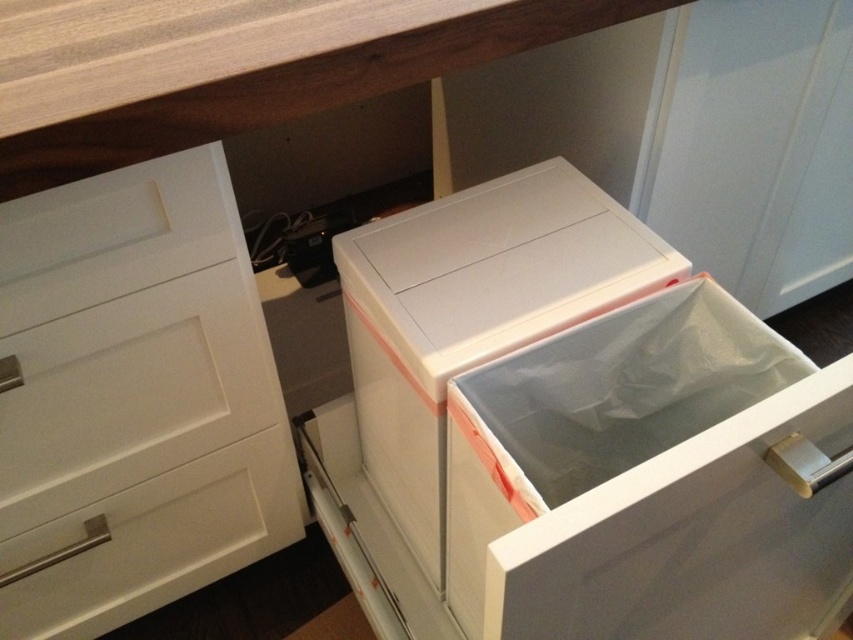
Is white matte drawer at left above wooden countertop at upper center?

Incorrect, white matte drawer at left is not positioned above wooden countertop at upper center.

Is white matte drawer at left further to camera compared to wooden countertop at upper center?

Yes, it is.

Between point (212, 278) and point (372, 16), which one is positioned in front?

Point (372, 16) is in front.

In order to click on white matte drawer at left in this screenshot , I will do click(132, 400).

Locate an element on the screen. white plastic file cabinet at center is located at coordinates (573, 433).

Between white plastic file cabinet at center and white matte drawer at left, which one appears on the right side from the viewer's perspective?

From the viewer's perspective, white plastic file cabinet at center appears more on the right side.

Is point (825, 634) closer to viewer compared to point (38, 244)?

No.

Image resolution: width=853 pixels, height=640 pixels. What are the coordinates of `white plastic file cabinet at center` in the screenshot? It's located at (573, 433).

Which is in front, point (434, 284) or point (332, 36)?

Point (332, 36) is more forward.

Is white plastic file cabinet at center below wooden countertop at upper center?

Correct, white plastic file cabinet at center is located below wooden countertop at upper center.

The image size is (853, 640). In order to click on white plastic file cabinet at center in this screenshot , I will do `click(573, 433)`.